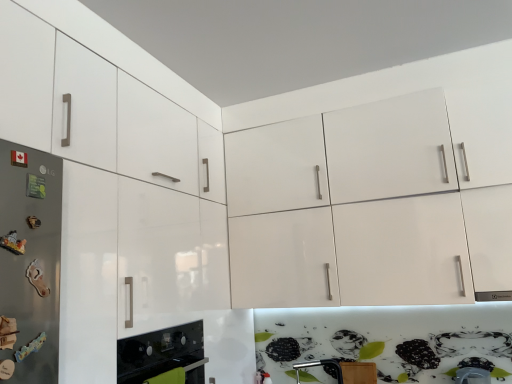
Question: Considering the relative positions of black glass oven at lower left and metallic screwdriver at lower center in the image provided, is black glass oven at lower left in front of metallic screwdriver at lower center?

Choices:
 (A) yes
 (B) no

Answer: (A)

Question: Does black glass oven at lower left have a lesser height compared to metallic screwdriver at lower center?

Choices:
 (A) no
 (B) yes

Answer: (A)

Question: From a real-world perspective, is black glass oven at lower left on top of metallic screwdriver at lower center?

Choices:
 (A) no
 (B) yes

Answer: (B)

Question: Can you confirm if black glass oven at lower left is smaller than metallic screwdriver at lower center?

Choices:
 (A) no
 (B) yes

Answer: (A)

Question: Is black glass oven at lower left bigger than metallic screwdriver at lower center?

Choices:
 (A) yes
 (B) no

Answer: (A)

Question: Is black glass oven at lower left to the right of metallic screwdriver at lower center from the viewer's perspective?

Choices:
 (A) no
 (B) yes

Answer: (A)

Question: From the image's perspective, would you say metallic screwdriver at lower center is positioned over glossy white cabinet at upper left?

Choices:
 (A) no
 (B) yes

Answer: (A)

Question: Does metallic screwdriver at lower center have a lesser width compared to glossy white cabinet at upper left?

Choices:
 (A) yes
 (B) no

Answer: (A)

Question: Is metallic screwdriver at lower center far from glossy white cabinet at upper left?

Choices:
 (A) yes
 (B) no

Answer: (A)

Question: From the image's perspective, is metallic screwdriver at lower center under glossy white cabinet at upper left?

Choices:
 (A) no
 (B) yes

Answer: (B)

Question: Can you confirm if metallic screwdriver at lower center is smaller than glossy white cabinet at upper left?

Choices:
 (A) no
 (B) yes

Answer: (B)

Question: Can you confirm if metallic screwdriver at lower center is positioned to the left of glossy white cabinet at upper left?

Choices:
 (A) no
 (B) yes

Answer: (A)

Question: Is glossy white cabinet at upper left surrounded by satin silver refrigerator at left?

Choices:
 (A) no
 (B) yes

Answer: (A)